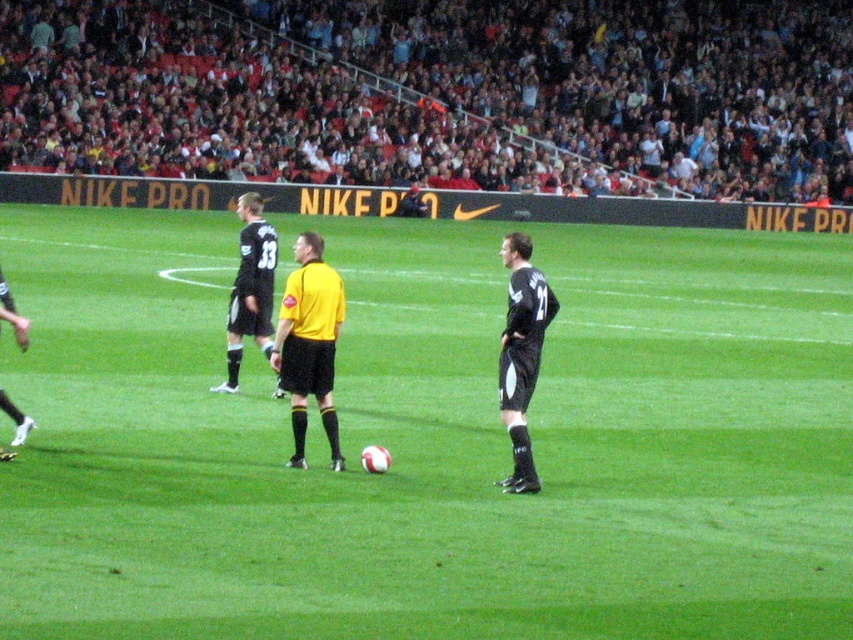
Question: Is black jersey at right closer to the viewer compared to black jersey at center?

Choices:
 (A) yes
 (B) no

Answer: (A)

Question: Which of these objects is positioned closest to the black jersey at left?

Choices:
 (A) yellow matte jersey at center
 (B) black jersey at center
 (C) red plastic seats at upper center

Answer: (A)

Question: Is red plastic seats at upper center above black jersey at right?

Choices:
 (A) no
 (B) yes

Answer: (B)

Question: Which object is the closest to the green grass soccer ball at center?

Choices:
 (A) black jersey at left
 (B) red plastic seats at upper center
 (C) black jersey at center
 (D) yellow matte jersey at center

Answer: (D)

Question: Is red plastic seats at upper center to the left of yellow matte jersey at center from the viewer's perspective?

Choices:
 (A) yes
 (B) no

Answer: (B)

Question: Which of the following is the farthest from the observer?

Choices:
 (A) pyautogui.click(x=294, y=291)
 (B) pyautogui.click(x=828, y=492)
 (C) pyautogui.click(x=250, y=198)
 (D) pyautogui.click(x=508, y=433)

Answer: (C)